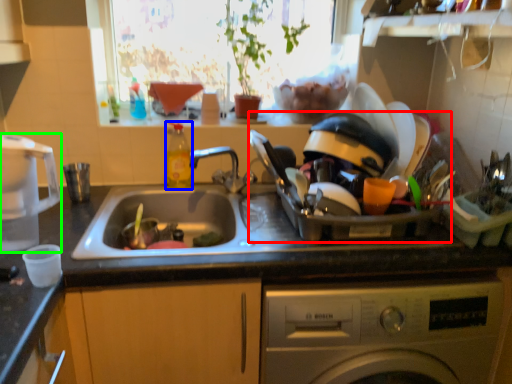
Question: Considering the real-world distances, which object is closest to appliance (highlighted by a red box)? bottle (highlighted by a blue box) or appliance (highlighted by a green box).

Choices:
 (A) bottle
 (B) appliance

Answer: (A)